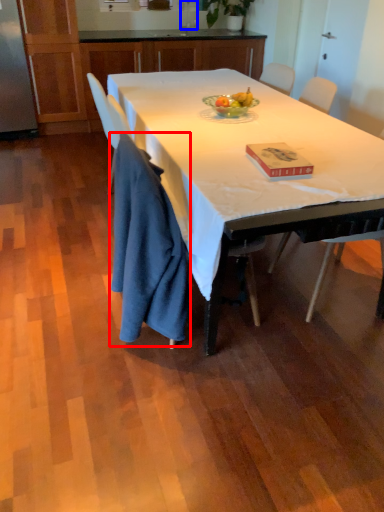
Question: Which point is further to the camera, cloth (highlighted by a red box) or sink (highlighted by a blue box)?

Choices:
 (A) cloth
 (B) sink

Answer: (B)